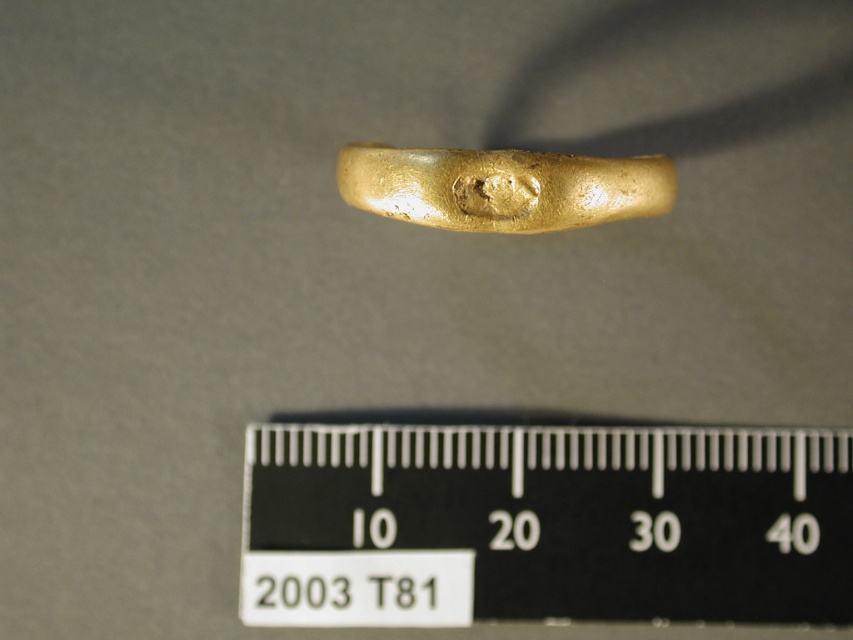
Question: Which point appears closest to the camera in this image?

Choices:
 (A) [399, 490]
 (B) [413, 157]

Answer: (B)

Question: Is black plastic ruler at center below shiny gold ring at center?

Choices:
 (A) no
 (B) yes

Answer: (B)

Question: Can you confirm if black plastic ruler at center is smaller than shiny gold ring at center?

Choices:
 (A) no
 (B) yes

Answer: (B)

Question: Which point is closer to the camera?

Choices:
 (A) shiny gold ring at center
 (B) black plastic ruler at center

Answer: (A)

Question: Where is black plastic ruler at center located in relation to shiny gold ring at center in the image?

Choices:
 (A) left
 (B) right

Answer: (B)

Question: Which object is farther from the camera taking this photo?

Choices:
 (A) shiny gold ring at center
 (B) black plastic ruler at center

Answer: (B)